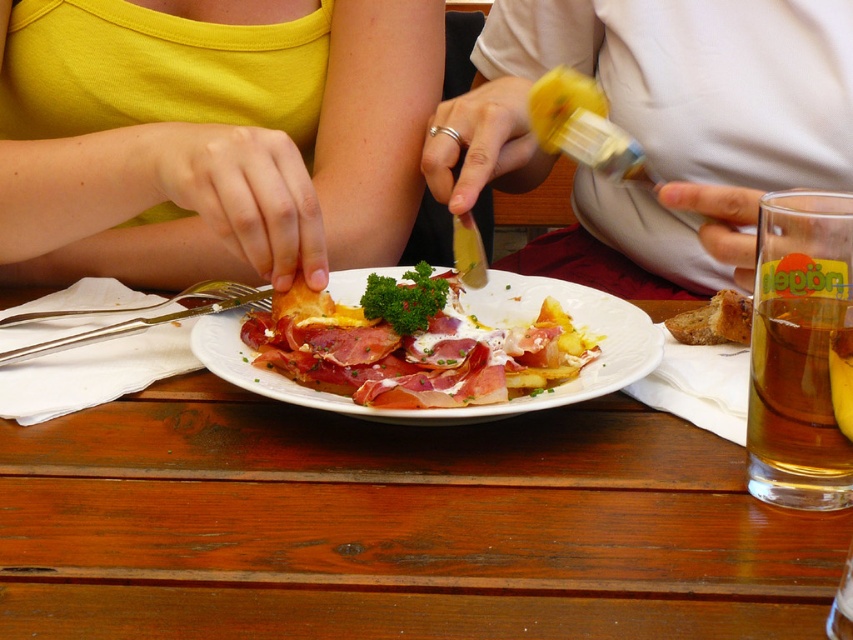
You are a food critic analyzing this meal. The golden amber liquid at right and brown crumbly bread at center are both on the table. Which item takes up more space on the table?

The golden amber liquid at right is larger in size than the brown crumbly bread at center, so it takes up more space on the table.

You are a photographer trying to capture a close shot of the white matte shirt at center without including the yellow matte tank top at upper left in the frame. Based on their positions, is this possible?

The yellow matte tank top at upper left is to the left of the white matte shirt at center, so if you position your camera to the right side of the white matte shirt at center, you can exclude the yellow matte tank top at upper left from the frame.